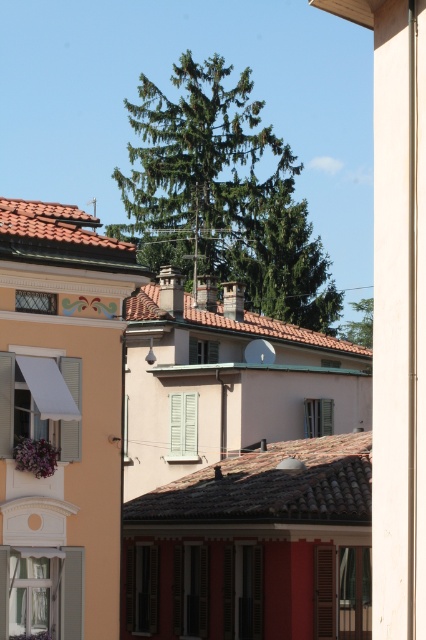
What is the object located at the point with coordinates (221, 195) in the image?

The point at coordinates (221, 195) marks a green needle like tree at upper center.